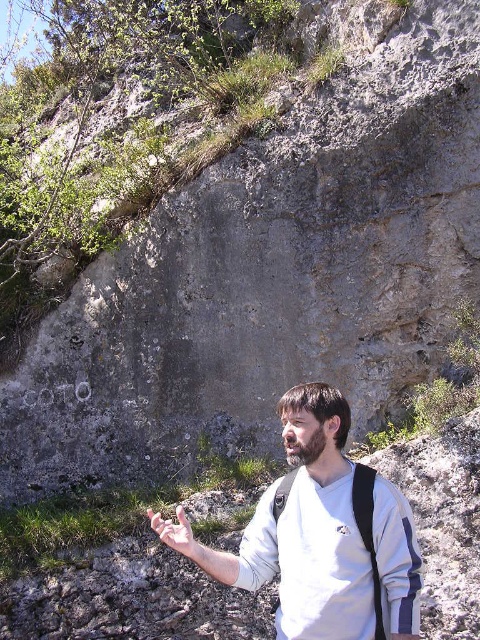
Question: Which point appears closest to the camera in this image?

Choices:
 (A) (194, 561)
 (B) (384, 600)

Answer: (B)

Question: Does white matte shirt at center appear on the left side of smooth skin hand at lower center?

Choices:
 (A) yes
 (B) no

Answer: (B)

Question: Is white matte shirt at center wider than smooth skin hand at lower center?

Choices:
 (A) no
 (B) yes

Answer: (B)

Question: Is white matte shirt at center wider than smooth skin hand at lower center?

Choices:
 (A) yes
 (B) no

Answer: (A)

Question: Which point is farther from the camera taking this photo?

Choices:
 (A) tap(180, 516)
 (B) tap(284, 504)

Answer: (B)